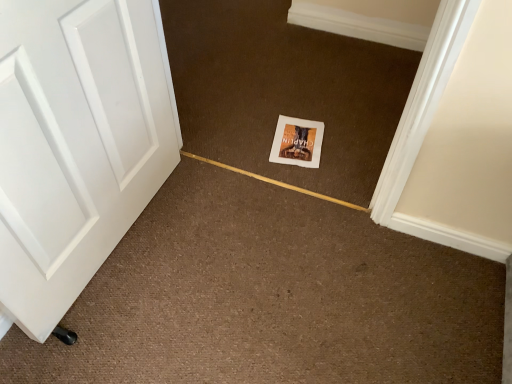
Image resolution: width=512 pixels, height=384 pixels. I want to click on white matte book at center, so click(284, 91).

Describe the element at coordinates (284, 91) in the screenshot. This screenshot has height=384, width=512. I see `white matte book at center` at that location.

In order to face white paper postcard at center, should I rotate leftwards or rightwards?

Rotate right and turn 5.896 degrees.

The image size is (512, 384). Describe the element at coordinates (297, 142) in the screenshot. I see `white paper postcard at center` at that location.

What is the approximate height of white paper postcard at center?

It is 0.53 inches.

I want to click on white paper postcard at center, so click(297, 142).

Locate an element on the screen. The image size is (512, 384). white matte book at center is located at coordinates (284, 91).

Can you confirm if white matte book at center is positioned to the left of white paper postcard at center?

Yes.

Is white matte book at center in front of or behind white paper postcard at center in the image?

Visually, white matte book at center is located in front of white paper postcard at center.

Between point (276, 106) and point (295, 163), which one is positioned in front?

The point (295, 163) is closer to the camera.

From the image's perspective, does white matte book at center appear higher than white paper postcard at center?

Yes, from the image's perspective, white matte book at center is above white paper postcard at center.

From a real-world perspective, is white matte book at center over white paper postcard at center?

Yes.

In terms of width, does white matte book at center look wider or thinner when compared to white paper postcard at center?

Clearly, white matte book at center has more width compared to white paper postcard at center.

Which of these two, white matte book at center or white paper postcard at center, stands taller?

white matte book at center.

Based on the photo, which of these two, white matte book at center or white paper postcard at center, is smaller?

white paper postcard at center is smaller.

Is white paper postcard at center located within white matte book at center?

Absolutely, white paper postcard at center is inside white matte book at center.

Would you say white matte book at center is a long distance from white paper postcard at center?

No.

Does white matte book at center turn towards white paper postcard at center?

Yes, white matte book at center is aimed at white paper postcard at center.

Locate an element on the screen. This screenshot has width=512, height=384. postcard to the right of white matte book at center is located at coordinates (297, 142).

Considering the relative positions of white paper postcard at center and white matte book at center in the image provided, is white paper postcard at center to the right of white matte book at center from the viewer's perspective?

Yes.

Looking at this image, relative to white matte book at center, is white paper postcard at center in front or behind?

Visually, white paper postcard at center is located behind white matte book at center.

Is point (292, 123) less distant than point (310, 34)?

Yes.

From the image's perspective, which one is positioned lower, white paper postcard at center or white matte book at center?

white paper postcard at center is shown below in the image.

From a real-world perspective, is white paper postcard at center physically located above or below white matte book at center?

white paper postcard at center is situated lower than white matte book at center in the real world.

Considering the sizes of objects white paper postcard at center and white matte book at center in the image provided, who is wider, white paper postcard at center or white matte book at center?

white matte book at center.

Who is shorter, white paper postcard at center or white matte book at center?

With less height is white paper postcard at center.

Consider the image. Can you confirm if white paper postcard at center is bigger than white matte book at center?

Incorrect, white paper postcard at center is not larger than white matte book at center.

Is white paper postcard at center not within white matte book at center?

That's incorrect, white paper postcard at center is not completely outside white matte book at center.

Is white paper postcard at center in contact with white matte book at center?

No, white paper postcard at center is not with white matte book at center.

Could you tell me if white paper postcard at center is turned towards white matte book at center?

Yes, white paper postcard at center faces towards white matte book at center.

The height and width of the screenshot is (384, 512). What are the coordinates of `plain on the left of white paper postcard at center` in the screenshot? It's located at (284, 91).

Where is `postcard behind the white matte book at center`? The height and width of the screenshot is (384, 512). postcard behind the white matte book at center is located at coordinates (297, 142).

Locate an element on the screen. Image resolution: width=512 pixels, height=384 pixels. postcard below the white matte book at center (from the image's perspective) is located at coordinates (297, 142).